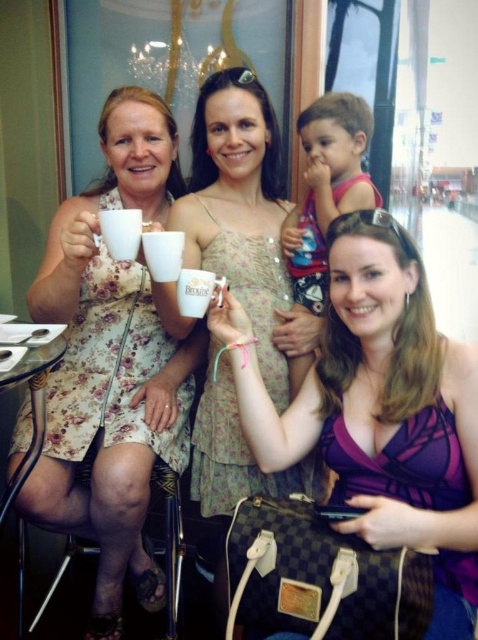
Is point (325, 150) farther from viewer compared to point (167, 259)?

Yes, point (325, 150) is behind point (167, 259).

Describe the element at coordinates (326, 188) in the screenshot. I see `pink fabric shirt at upper center` at that location.

Does point (325, 134) come behind point (148, 232)?

Yes, it is behind point (148, 232).

The height and width of the screenshot is (640, 478). In order to click on pink fabric shirt at upper center in this screenshot , I will do `click(326, 188)`.

Who is lower down, purple fabric dress at center or floral fabric dress at left?

purple fabric dress at center is below.

Who is shorter, purple fabric dress at center or floral fabric dress at left?

purple fabric dress at center

At what (x,y) coordinates should I click in order to perform the action: click on purple fabric dress at center. Please return your answer as a coordinate pair (x, y). Looking at the image, I should click on (380, 410).

Does white matte mug at upper center have a greater width compared to white ceramic mug at center?

Indeed, white matte mug at upper center has a greater width compared to white ceramic mug at center.

Who is more distant from viewer, (128, 234) or (177, 300)?

The point (177, 300) is behind.

This screenshot has width=478, height=640. What are the coordinates of `white matte mug at upper center` in the screenshot? It's located at (121, 232).